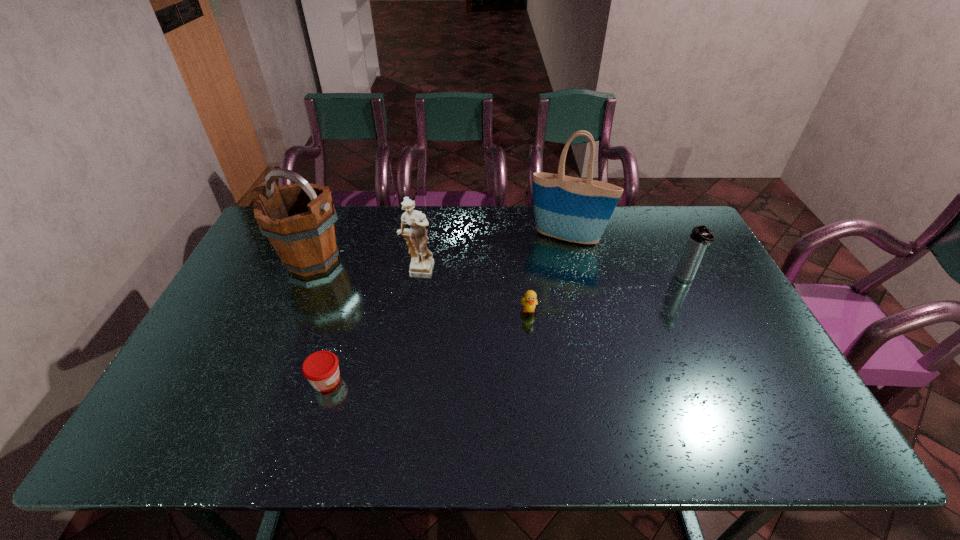
The width and height of the screenshot is (960, 540). Find the location of `vacant point that satisfies the following two spatial constraints: 1. on the handle side of the rightmost object; 2. on the label side of the nearest object`. vacant point that satisfies the following two spatial constraints: 1. on the handle side of the rightmost object; 2. on the label side of the nearest object is located at coordinates (733, 380).

Identify the location of blank area in the image that satisfies the following two spatial constraints: 1. on the front-facing side of the third object from right to left; 2. on the label side of the second object from left to right. Image resolution: width=960 pixels, height=540 pixels. (537, 380).